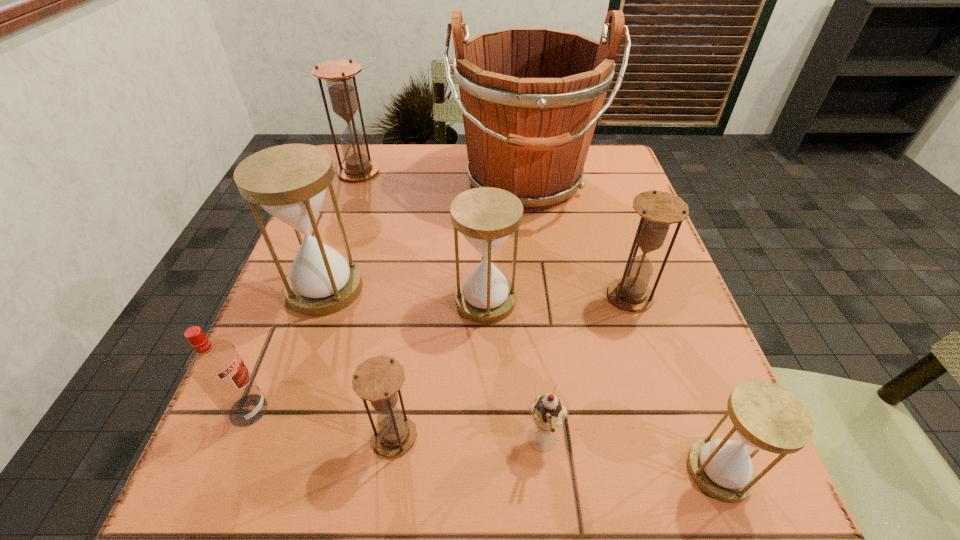
The image size is (960, 540). I want to click on object located at the near right corner, so click(x=765, y=416).

Locate an element on the screen. The image size is (960, 540). blank space at the far edge of the desktop is located at coordinates (432, 160).

In the image, there is a desktop. Where is `vacant region at the left edge`? The height and width of the screenshot is (540, 960). vacant region at the left edge is located at coordinates (327, 334).

Locate an element on the screen. free region at the right edge of the desktop is located at coordinates (699, 427).

Locate an element on the screen. Image resolution: width=960 pixels, height=540 pixels. vacant space at the near left corner of the desktop is located at coordinates [239, 497].

You are a GUI agent. You are given a task and a screenshot of the screen. Output one action in this format:
    pyautogui.click(x=<x>, y=<y>)
    Task: Click on the blank region between the icecream and the biggest white hourglass
    
    Given the screenshot: What is the action you would take?
    pyautogui.click(x=434, y=366)

Locate an element on the screen. free space that is in between the biggest white hourglass and the vodka is located at coordinates (287, 349).

Identify the location of free space between the fourth hourglass from right to left and the shortest object. This screenshot has width=960, height=540. (469, 440).

Identify the location of vacant area that lies between the rightmost white hourglass and the second farthest brown hourglass. The image size is (960, 540). (675, 383).

Where is `vacant area that lies between the bucket and the rightmost white hourglass`? Image resolution: width=960 pixels, height=540 pixels. vacant area that lies between the bucket and the rightmost white hourglass is located at coordinates (622, 327).